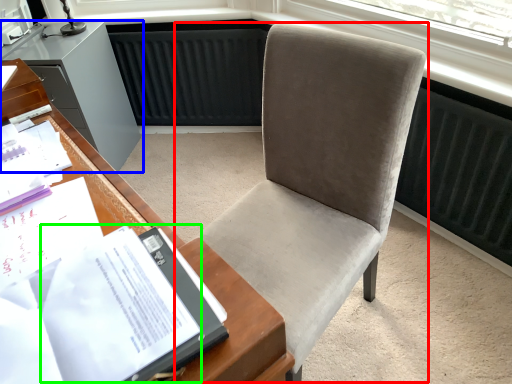
Question: Which object is the closest to the chair (highlighted by a red box)? Choose among these: cabinetry (highlighted by a blue box) or journal (highlighted by a green box).

Choices:
 (A) cabinetry
 (B) journal

Answer: (B)